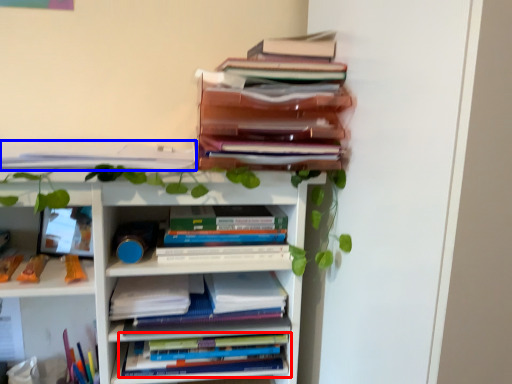
Question: Which of the following is the closest to the observer, book (highlighted by a red box) or book (highlighted by a blue box)?

Choices:
 (A) book
 (B) book

Answer: (B)